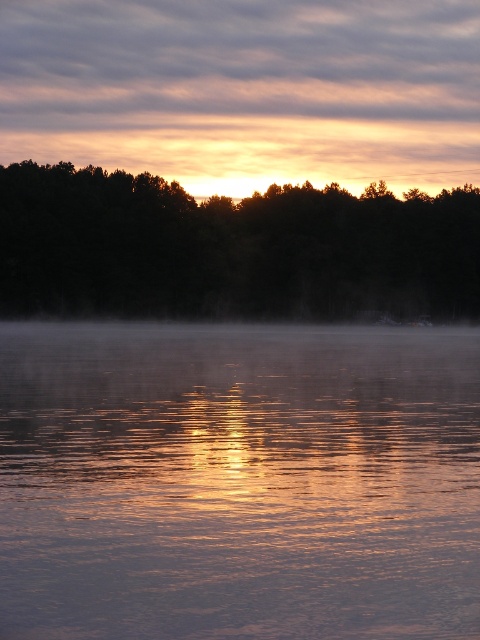
Question: Is glistening water at center closer to the viewer compared to dark green forest at center?

Choices:
 (A) no
 (B) yes

Answer: (B)

Question: Is the position of glistening water at center more distant than that of dark green forest at center?

Choices:
 (A) yes
 (B) no

Answer: (B)

Question: Which object is closer to the camera taking this photo?

Choices:
 (A) glistening water at center
 (B) dark green forest at center

Answer: (A)

Question: Can you confirm if glistening water at center is positioned below dark green forest at center?

Choices:
 (A) yes
 (B) no

Answer: (A)

Question: Which object appears closest to the camera in this image?

Choices:
 (A) glistening water at center
 (B) dark green forest at center

Answer: (A)